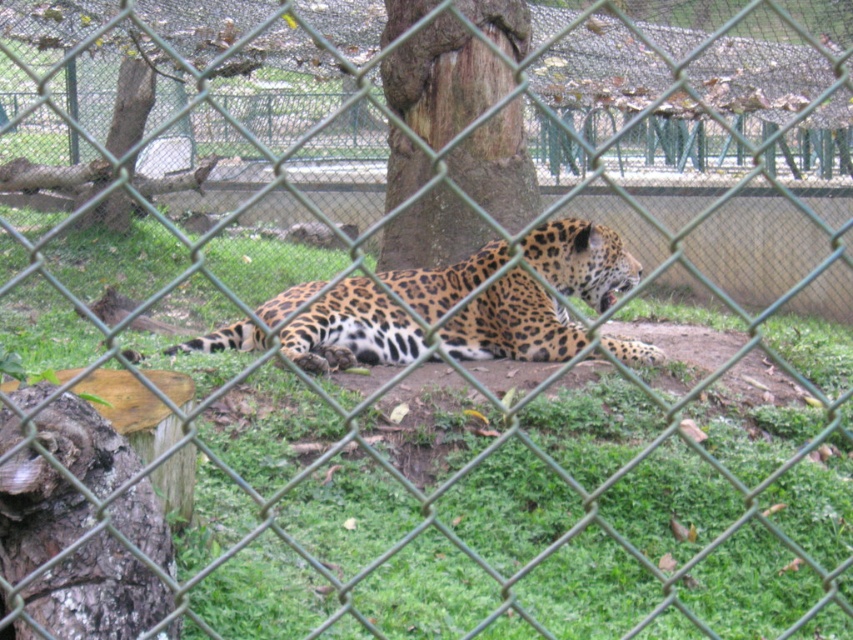
Based on the photo, you are a zookeeper trying to determine if the spotted fur jaguar at center can fit through the fence gaps in the enclosure. The brown rough bark at center is partially blocking your view. Based on their sizes, can the jaguar pass through the gaps in the fence?

The spotted fur jaguar at center is not as tall as brown rough bark at center. Since the jaguar is shorter than the brown rough bark at center, it is possible that the jaguar can fit through the fence gaps if the gaps are larger than the jaguar.

You are a zookeeper who needs to place a feeding tray between the spotted fur jaguar at center and the brown rough bark at center. Which side of the jaguar should you place it so that it is closer to the bark?

The spotted fur jaguar at center is positioned on the left side of brown rough bark at center, so placing the feeding tray to the right side of the jaguar would bring it closer to the bark.

You are a zookeeper trying to feed the spotted fur jaguar at center. You have a food tray placed on the brown rough bark at center. Can you reach the jaguar without stepping over the fence?

The spotted fur jaguar at center is closer to the viewer than the brown rough bark at center. Therefore, the distance between the jaguar and the bark may be too far for the zookeeper to reach without crossing the fence. However, the exact reach capability of the zookeeper or the length of the feeding tool isnecessary to determine this accurately.